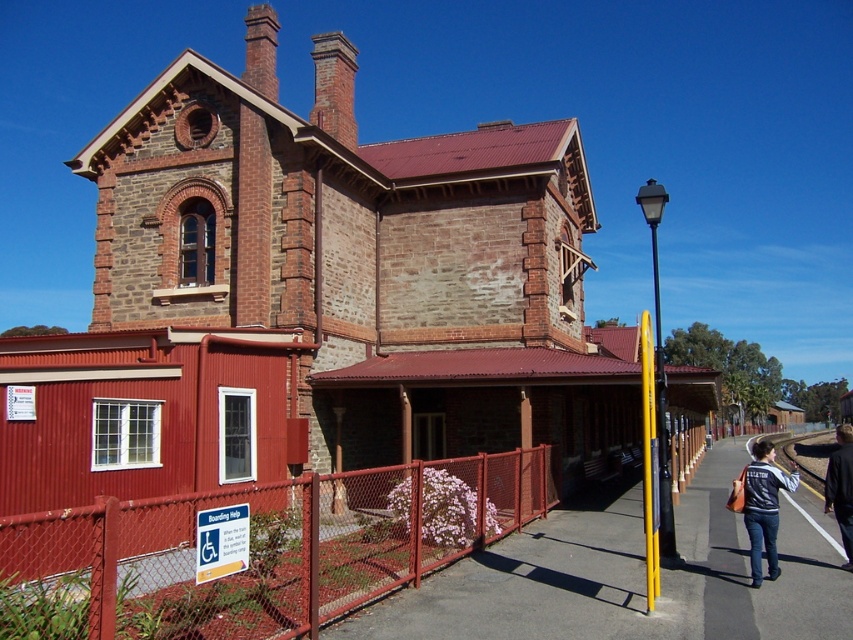
You are standing on the pathway in front of the historic brick building and see two points marked on the ground. One is labeled as point (148,134) and the other as point (194,522). Which point is closer to the building?

Point (148,134) is behind point (194,522), so the point closer to the building is point (194,522).